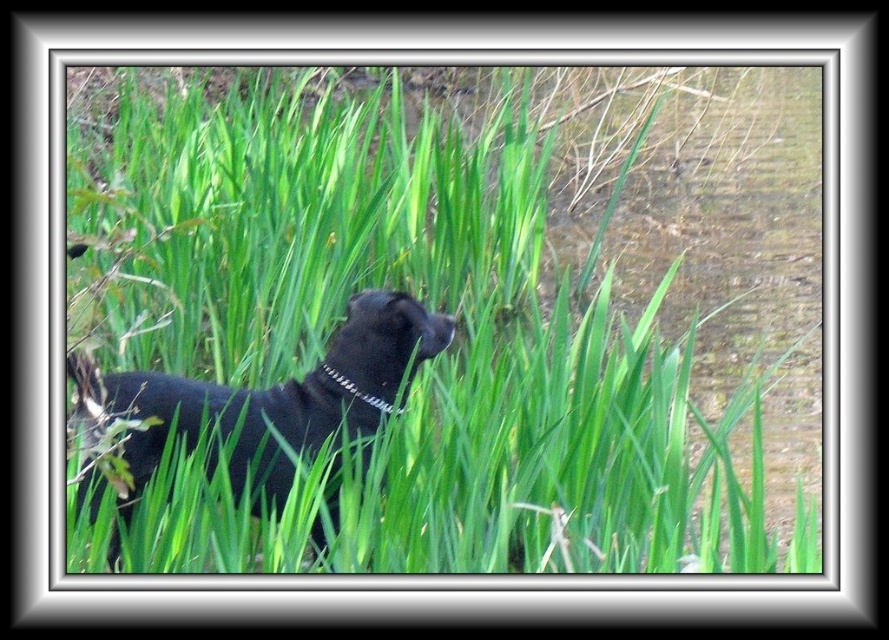
Between point (557, 99) and point (175, 408), which one is positioned behind?

Positioned behind is point (557, 99).

Where is `green leafy grass at center`? The image size is (889, 640). green leafy grass at center is located at coordinates (413, 323).